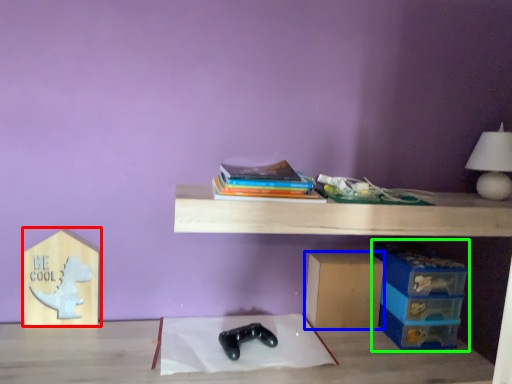
Question: Which object is the farthest from cardboard box (highlighted by a red box)? Choose among these: cardboard box (highlighted by a blue box) or storage box (highlighted by a green box).

Choices:
 (A) cardboard box
 (B) storage box

Answer: (B)